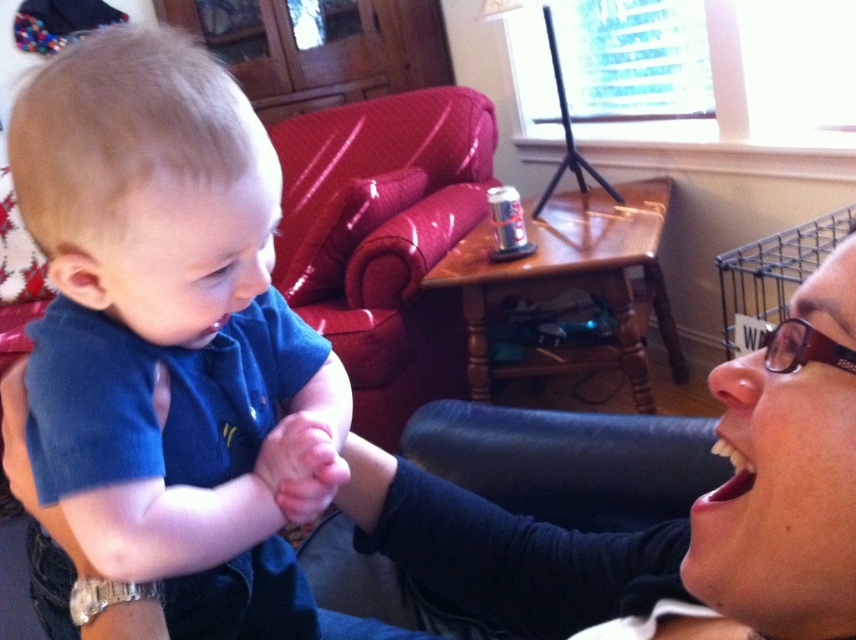
You are a photographer adjusting your camera settings. You notice two points in the frame at coordinates point (831, 253) and point (807, 362). Which point is closer to the camera lens?

Point (831, 253) is further to the camera than point (807, 362), so the closer point to the camera lens is point (807, 362).

You are a photographer setting up a shoot in this living room. You need to position a light source between the glossy vinyl armchair at upper center and the matte black glasses at lower right. Based on their positions, which object should the light be closer to?

The glossy vinyl armchair at upper center is to the left of the matte black glasses at lower right. Since the light needs to be placed between them, it should be closer to the glossy vinyl armchair at upper center as it is positioned to the left side of the glasses.